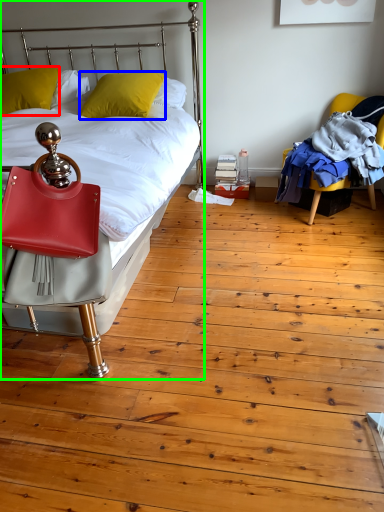
Question: Which object is positioned closest to pillow (highlighted by a red box)? Select from pillow (highlighted by a blue box) and bed (highlighted by a green box).

Choices:
 (A) pillow
 (B) bed

Answer: (A)